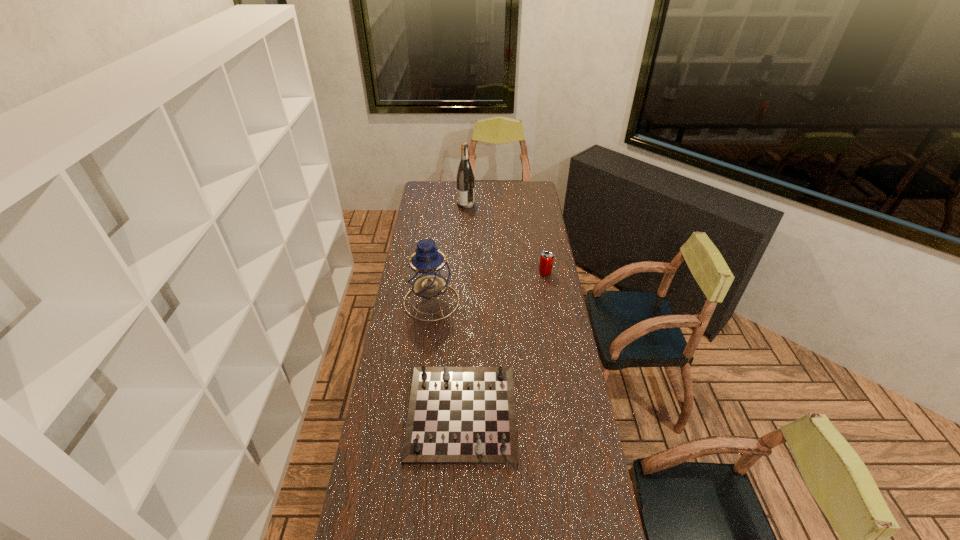
Image resolution: width=960 pixels, height=540 pixels. Find the location of `vacant region between the shortest object and the second nearest object`. vacant region between the shortest object and the second nearest object is located at coordinates (446, 357).

At what (x,y) coordinates should I click in order to perform the action: click on free area in between the second shortest object and the second nearest object. Please return your answer as a coordinate pair (x, y). Looking at the image, I should click on (489, 287).

Where is `free space between the third nearest object and the third farthest object`? free space between the third nearest object and the third farthest object is located at coordinates (489, 287).

Where is `vacant space in between the wine bottle and the third farthest object`? vacant space in between the wine bottle and the third farthest object is located at coordinates (448, 253).

You are a GUI agent. You are given a task and a screenshot of the screen. Output one action in this format:
    pyautogui.click(x=<x>, y=<y>)
    Task: Click on the free space that is in between the wine bottle and the second farthest object
    Image resolution: width=960 pixels, height=540 pixels.
    Given the screenshot: What is the action you would take?
    pyautogui.click(x=506, y=239)

Where is `object that is the third closest to the second nearest object`? Image resolution: width=960 pixels, height=540 pixels. object that is the third closest to the second nearest object is located at coordinates click(465, 178).

Where is `object that is the third closest to the farthest object`? The height and width of the screenshot is (540, 960). object that is the third closest to the farthest object is located at coordinates (457, 415).